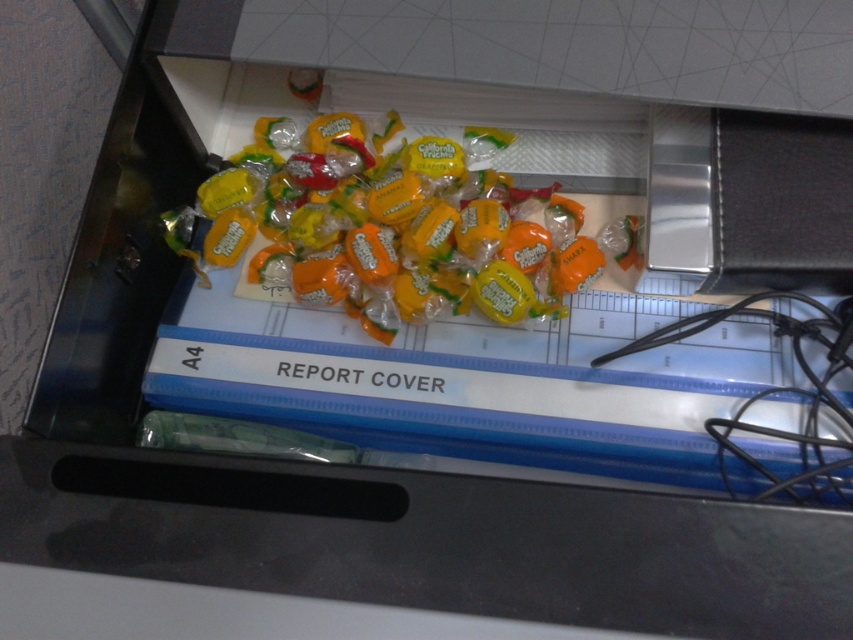
Question: Does yellow matte candy at center have a greater width compared to black rubber wire at right?

Choices:
 (A) yes
 (B) no

Answer: (A)

Question: Observing the image, what is the correct spatial positioning of yellow matte candy at center in reference to black rubber wire at right?

Choices:
 (A) above
 (B) below

Answer: (A)

Question: Is yellow matte candy at center positioned at the back of black rubber wire at right?

Choices:
 (A) yes
 (B) no

Answer: (A)

Question: Which of the following is the farthest from the observer?

Choices:
 (A) yellow matte candy at center
 (B) black rubber wire at right

Answer: (A)